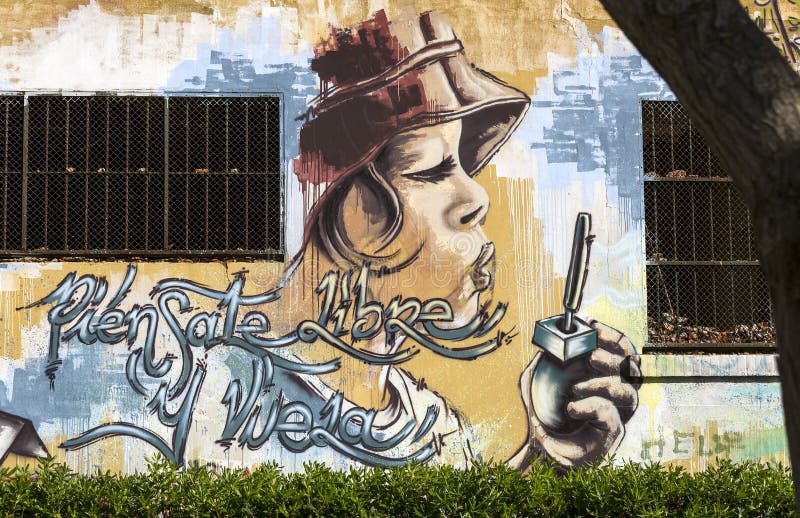
Image resolution: width=800 pixels, height=518 pixels. Find the location of `wall`. wall is located at coordinates (594, 190).